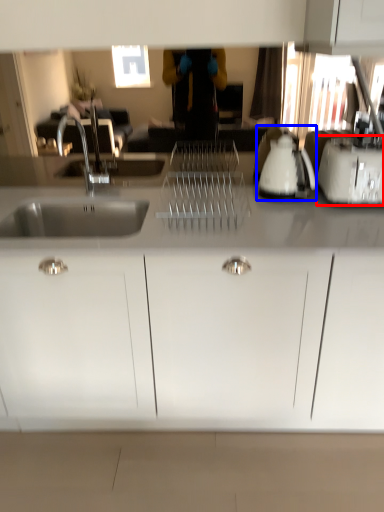
Question: Which of the following is the farthest to the observer, toaster (highlighted by a red box) or appliance (highlighted by a blue box)?

Choices:
 (A) toaster
 (B) appliance

Answer: (B)